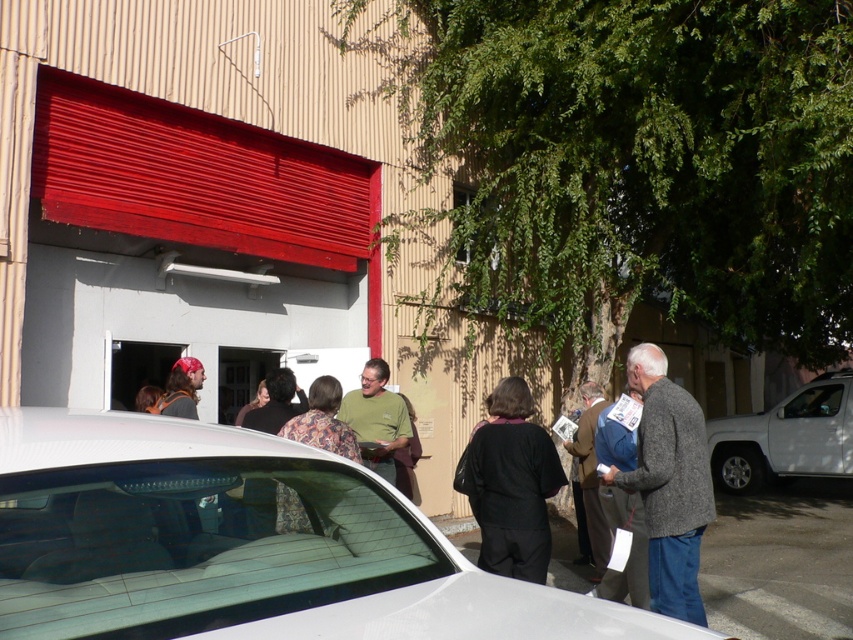
You are a delivery person who needs to place a large package in the area shown. The package is too big to fit in the black matte coat at center. Where can you put it instead, considering the white matte truck at right is available?

The white matte truck at right is larger than the black matte coat at center, so the large package can be placed in the white matte truck at right.